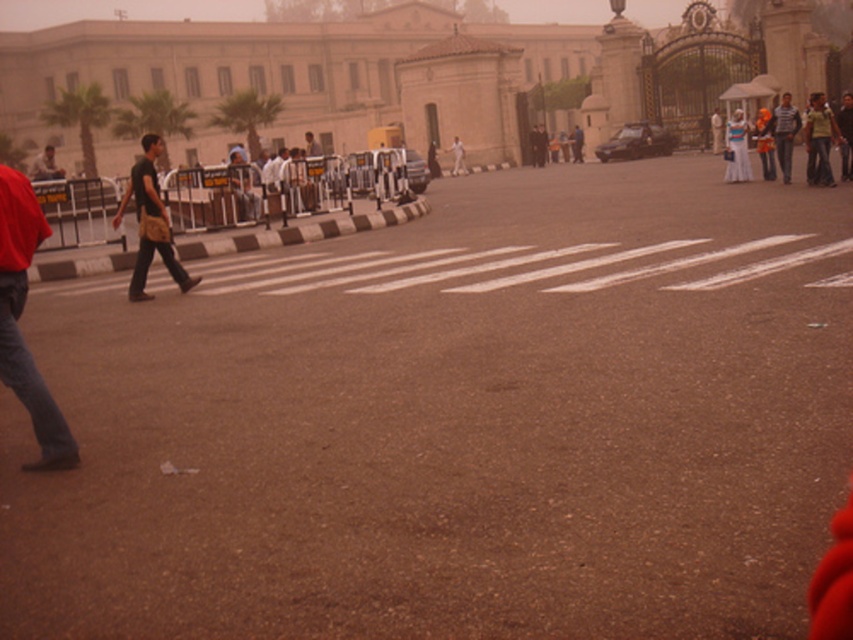
You are a delivery driver who needs to check if there is enough space between the denim jeans at left and the matte black helmet at center to safely pass through with your vehicle. Can you determine if the space is sufficient?

The denim jeans at left occupies less space than matte black helmet at center, so the space between them may be sufficient for a vehicle to pass safely, but the exact dimensions are not provided. Please ensure there is enough clearance before proceeding.